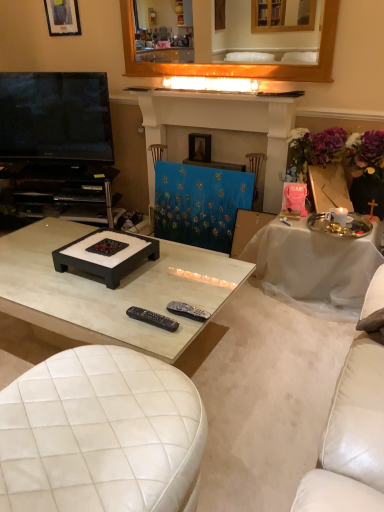
Where is `free point to the left of black plastic remote control at center, which ranks as the second remote control in right-to-left order`? Image resolution: width=384 pixels, height=512 pixels. free point to the left of black plastic remote control at center, which ranks as the second remote control in right-to-left order is located at coordinates (110, 321).